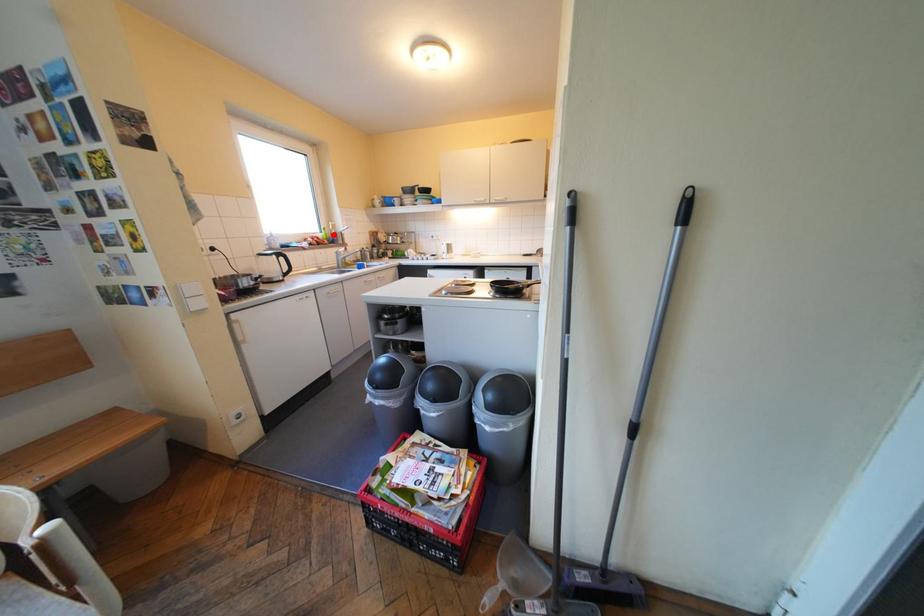
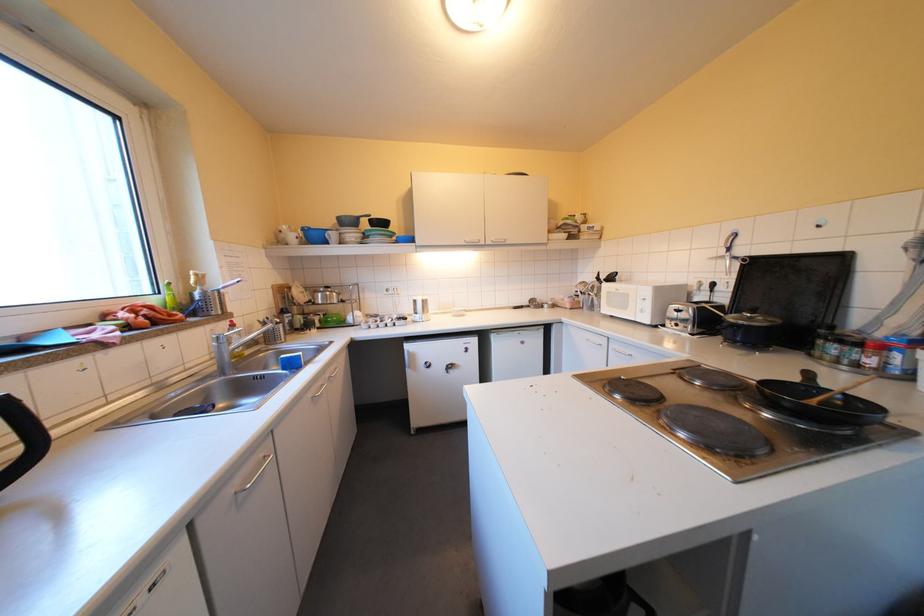
In the second image, find the point that corresponds to the highlighted location in the first image.

(167, 300)